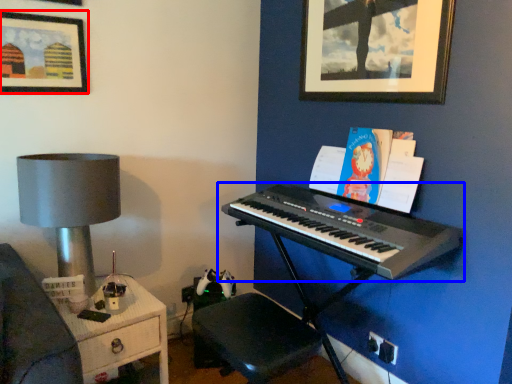
Question: Which of the following is the closest to the observer, picture frame (highlighted by a red box) or musical keyboard (highlighted by a blue box)?

Choices:
 (A) picture frame
 (B) musical keyboard

Answer: (B)